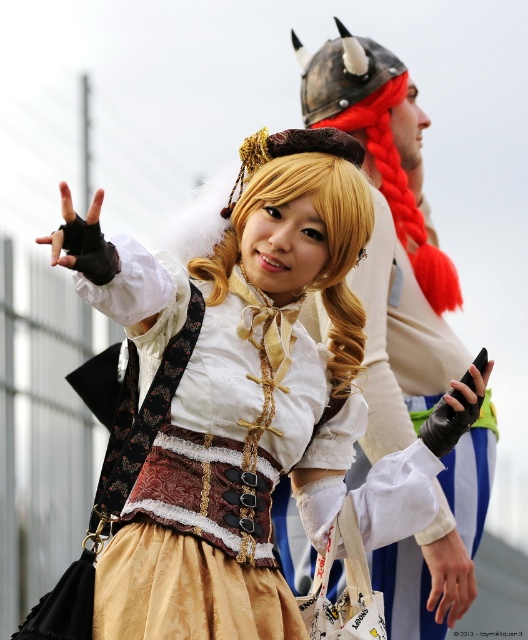
From the picture: Between white fabric helmet at upper center and metallic silver helmet at upper center, which one appears on the right side from the viewer's perspective?

Positioned to the right is metallic silver helmet at upper center.

Does point (370, 246) lie behind point (325, 72)?

No, it is not.

Is point (430, 268) in front of point (401, 80)?

Yes, point (430, 268) is closer to viewer.

Identify the location of white fabric helmet at upper center. The height and width of the screenshot is (640, 528). (389, 237).

Is matte gold skirt at center shorter than white fabric helmet at upper center?

Indeed, matte gold skirt at center has a lesser height compared to white fabric helmet at upper center.

Who is shorter, matte gold skirt at center or white fabric helmet at upper center?

matte gold skirt at center

What do you see at coordinates (228, 392) in the screenshot? The image size is (528, 640). I see `matte gold skirt at center` at bounding box center [228, 392].

Identify the location of matte gold skirt at center. (228, 392).

Does matte gold skirt at center have a smaller size compared to metallic silver helmet at upper center?

Actually, matte gold skirt at center might be larger than metallic silver helmet at upper center.

Does point (350, 154) come behind point (452, 298)?

No, (350, 154) is in front of (452, 298).

Locate an element on the screen. Image resolution: width=528 pixels, height=640 pixels. matte gold skirt at center is located at coordinates (228, 392).